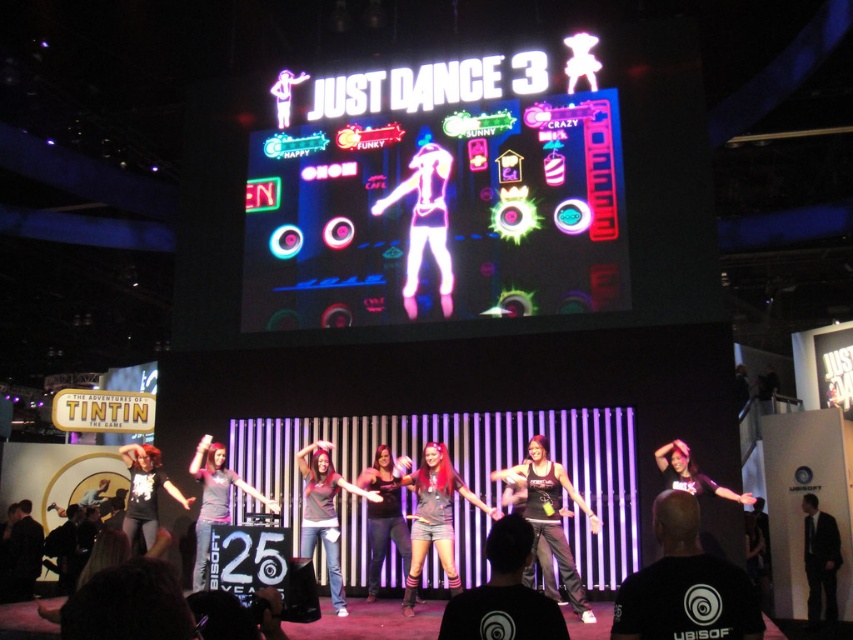
Is point (422, 486) positioned in front of point (367, 596)?

Yes.

Is shiny black tank top at center behind matte black shirt at center?

No, shiny black tank top at center is closer to the viewer.

Describe the element at coordinates (434, 516) in the screenshot. I see `shiny black tank top at center` at that location.

Where is `shiny black tank top at center`? shiny black tank top at center is located at coordinates (434, 516).

Looking at this image, can you confirm if black fabric tank top at center is bigger than neon pink holographic dancer at center?

Incorrect, black fabric tank top at center is not larger than neon pink holographic dancer at center.

Between black fabric tank top at center and neon pink holographic dancer at center, which one appears on the right side from the viewer's perspective?

black fabric tank top at center is more to the right.

The height and width of the screenshot is (640, 853). What are the coordinates of `black fabric tank top at center` in the screenshot? It's located at (547, 515).

Where is `black fabric tank top at center`? black fabric tank top at center is located at coordinates (547, 515).

Does matte black shirt at center come behind gray matte shirt at center?

No.

Can you confirm if matte black shirt at center is bigger than gray matte shirt at center?

Indeed, matte black shirt at center has a larger size compared to gray matte shirt at center.

What do you see at coordinates (383, 516) in the screenshot? I see `matte black shirt at center` at bounding box center [383, 516].

Find the location of `matte black shirt at center`. matte black shirt at center is located at coordinates (383, 516).